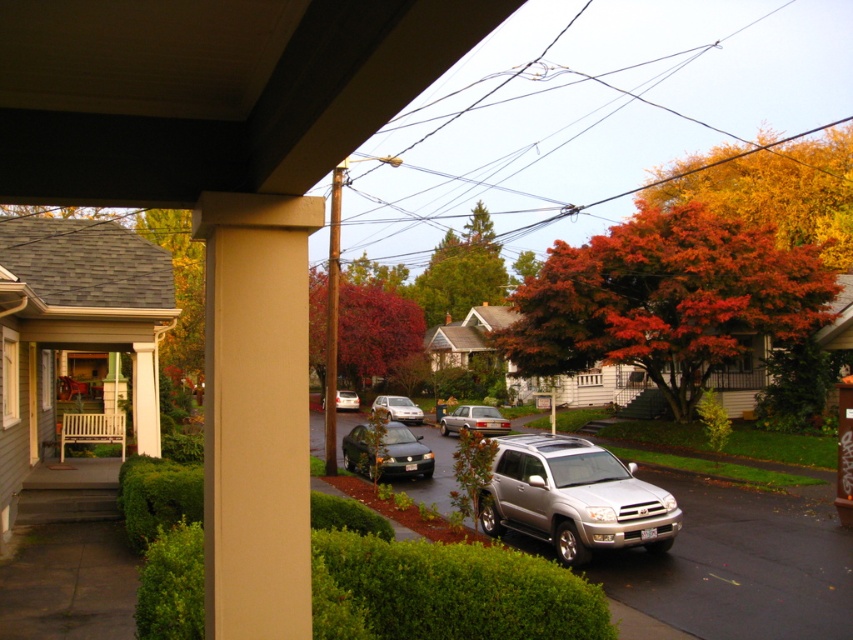
Question: Is orange leafy tree at upper right thinner than silver metallic sedan at center?

Choices:
 (A) yes
 (B) no

Answer: (B)

Question: Can you confirm if metallic silver sedan at center is positioned to the right of satin silver sedan at center?

Choices:
 (A) no
 (B) yes

Answer: (B)

Question: Which object is the farthest from the shiny red leaves at center?

Choices:
 (A) metallic silver sedan at center
 (B) beige smooth column at center
 (C) green leafy tree at left
 (D) silver metallic suv at lower right

Answer: (B)

Question: Which point is farther from the camera taking this photo?

Choices:
 (A) (733, 276)
 (B) (445, 413)
 (C) (410, 401)
 (D) (412, 472)

Answer: (C)

Question: Where is reddish-brown textured tree at center-right located in relation to satin silver sedan at center in the image?

Choices:
 (A) right
 (B) left

Answer: (A)

Question: Which object is positioned farthest from the reddish-brown textured tree at center-right?

Choices:
 (A) green leafy tree at left
 (B) shiny black sedan at center
 (C) metallic silver sedan at center

Answer: (A)